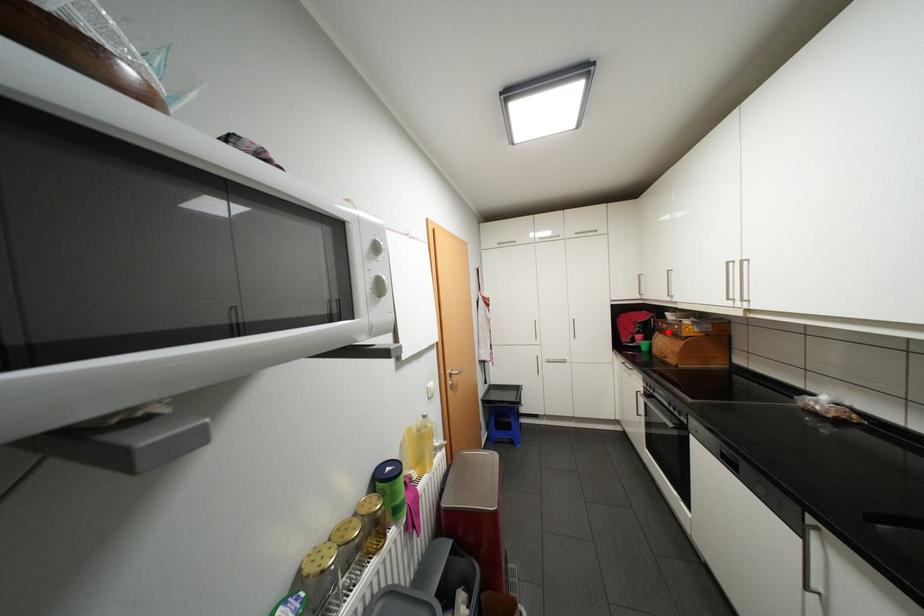
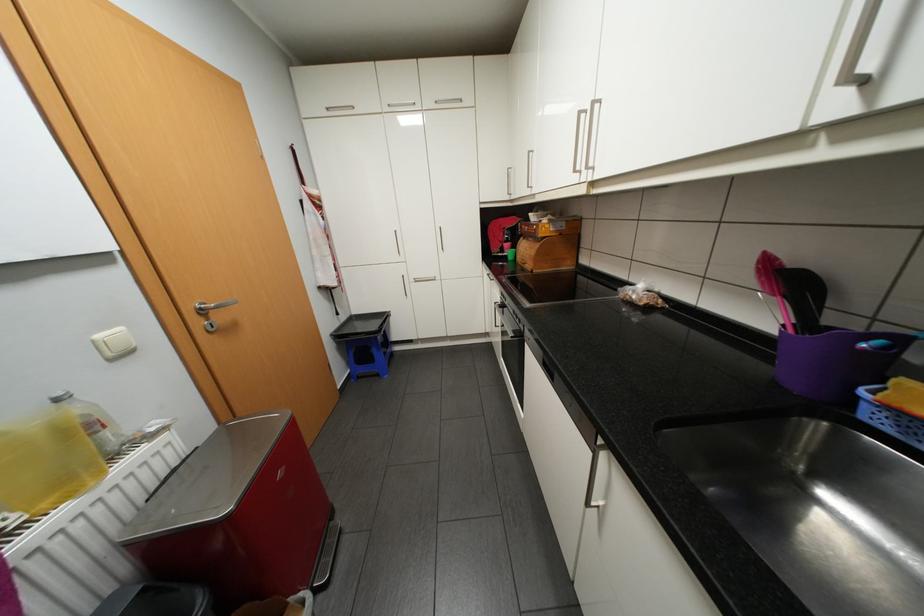
Locate, in the second image, the point that corresponds to the highlighted location in the first image.

(531, 237)